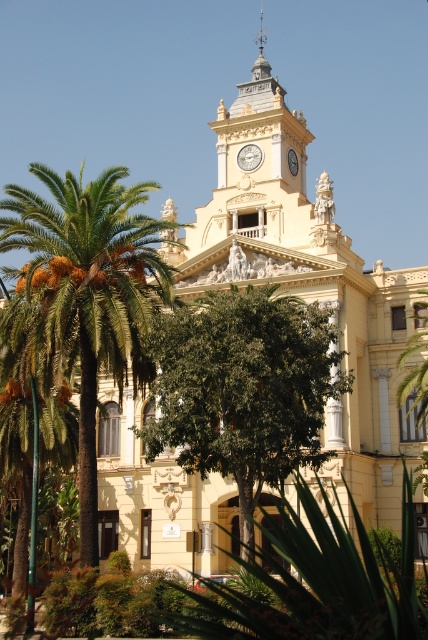
Question: Can you confirm if green leafy palm tree at left is positioned to the left of white glossy clock at upper center?

Choices:
 (A) yes
 (B) no

Answer: (A)

Question: Which point is farther from the camera taking this photo?

Choices:
 (A) (163, 221)
 (B) (252, 301)
 (C) (237, 161)

Answer: (C)

Question: Is green leafy palm tree at left to the right of white glossy clock at upper center from the viewer's perspective?

Choices:
 (A) no
 (B) yes

Answer: (A)

Question: Which object is farther from the camera taking this photo?

Choices:
 (A) white glossy clock at upper center
 (B) green leafy palm tree at left
 (C) green leafy tree at center

Answer: (A)

Question: Among these points, which one is farthest from the camera?

Choices:
 (A) 278,444
 (B) 258,160
 (C) 109,241

Answer: (B)

Question: Is green leafy tree at center above white glossy clock at upper center?

Choices:
 (A) no
 (B) yes

Answer: (A)